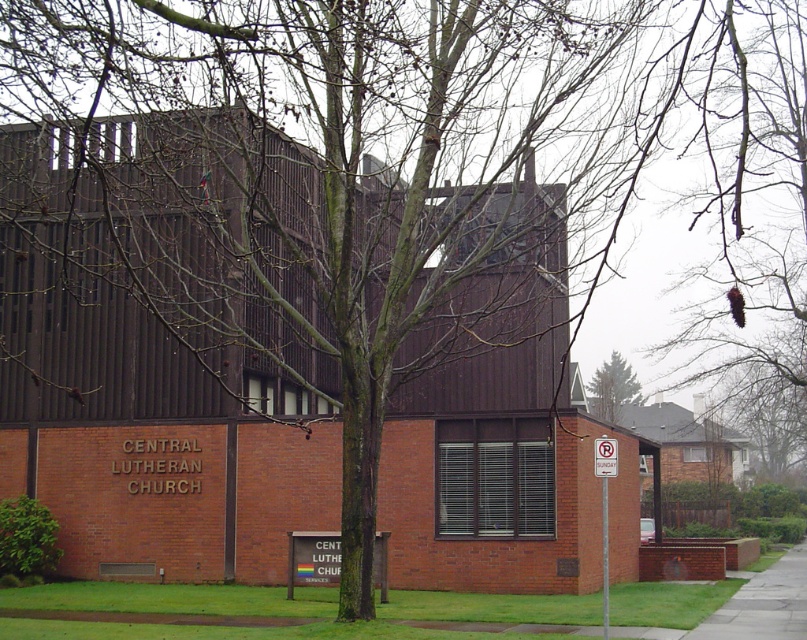
In the scene shown: Between gray concrete sidewalk at lower right and green coniferous tree at upper center, which one has more height?

Standing taller between the two is gray concrete sidewalk at lower right.

Who is lower down, gray concrete sidewalk at lower right or green coniferous tree at upper center?

gray concrete sidewalk at lower right is lower down.

The height and width of the screenshot is (640, 807). Find the location of `gray concrete sidewalk at lower right`. gray concrete sidewalk at lower right is located at coordinates (763, 604).